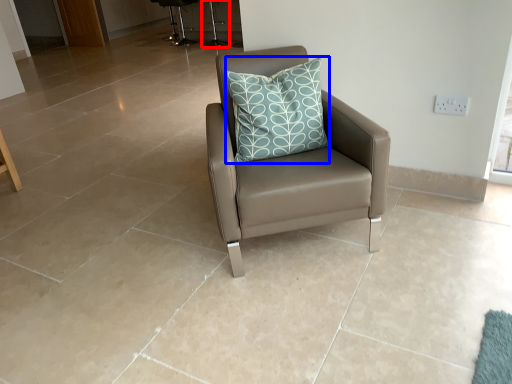
Question: Which object is further to the camera taking this photo, bar stool (highlighted by a red box) or pillow (highlighted by a blue box)?

Choices:
 (A) bar stool
 (B) pillow

Answer: (A)